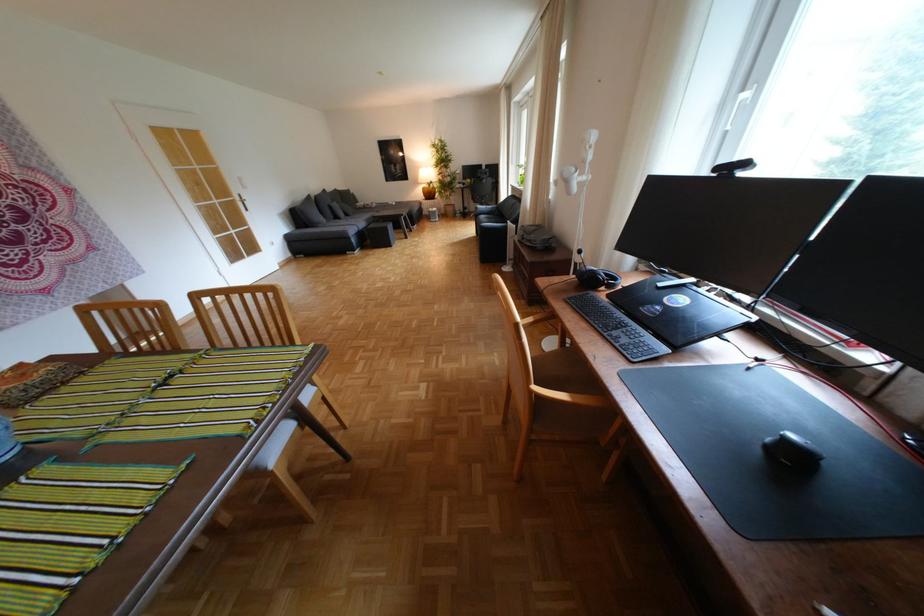
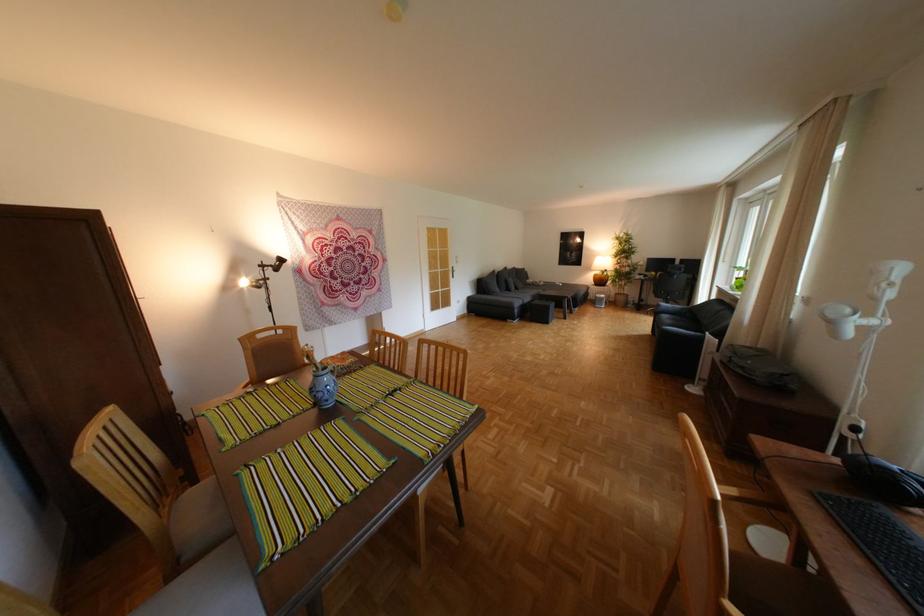
Question: How did the camera likely rotate?

Choices:
 (A) Left
 (B) Right
 (C) Up
 (D) Down

Answer: (A)